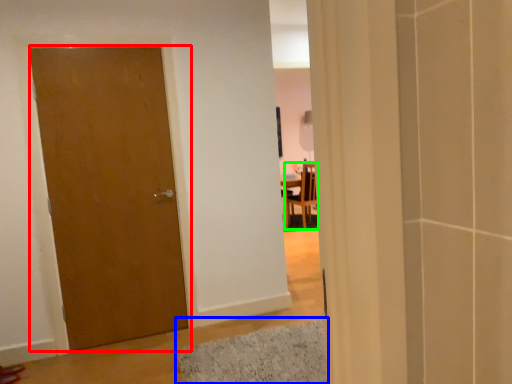
Question: Which is farther away from door (highlighted by a red box)? bath mat (highlighted by a blue box) or chair (highlighted by a green box)?

Choices:
 (A) bath mat
 (B) chair

Answer: (B)